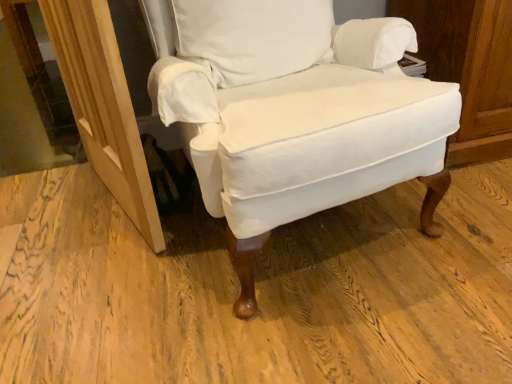
Question: Does wooden screen door at lower left come in front of white fabric chair at center?

Choices:
 (A) no
 (B) yes

Answer: (A)

Question: Is wooden screen door at lower left taller than white fabric chair at center?

Choices:
 (A) yes
 (B) no

Answer: (B)

Question: Is wooden screen door at lower left positioned with its back to white fabric chair at center?

Choices:
 (A) yes
 (B) no

Answer: (A)

Question: Is wooden screen door at lower left behind white fabric chair at center?

Choices:
 (A) yes
 (B) no

Answer: (A)

Question: From the image's perspective, is wooden screen door at lower left under white fabric chair at center?

Choices:
 (A) yes
 (B) no

Answer: (A)

Question: Is wooden screen door at lower left oriented towards white fabric chair at center?

Choices:
 (A) yes
 (B) no

Answer: (B)

Question: Would you say wooden screen door at lower left is part of white fabric chair at center's contents?

Choices:
 (A) no
 (B) yes

Answer: (A)

Question: Considering the relative sizes of white fabric chair at center and wooden screen door at lower left in the image provided, is white fabric chair at center thinner than wooden screen door at lower left?

Choices:
 (A) no
 (B) yes

Answer: (A)

Question: Does white fabric chair at center turn towards wooden screen door at lower left?

Choices:
 (A) yes
 (B) no

Answer: (B)

Question: From a real-world perspective, is white fabric chair at center located higher than wooden screen door at lower left?

Choices:
 (A) yes
 (B) no

Answer: (A)

Question: Is white fabric chair at center positioned beyond the bounds of wooden screen door at lower left?

Choices:
 (A) yes
 (B) no

Answer: (A)

Question: Is white fabric chair at center directly adjacent to wooden screen door at lower left?

Choices:
 (A) no
 (B) yes

Answer: (A)

Question: From the image's perspective, is white fabric chair at center located beneath white cotton pillow at center?

Choices:
 (A) yes
 (B) no

Answer: (A)